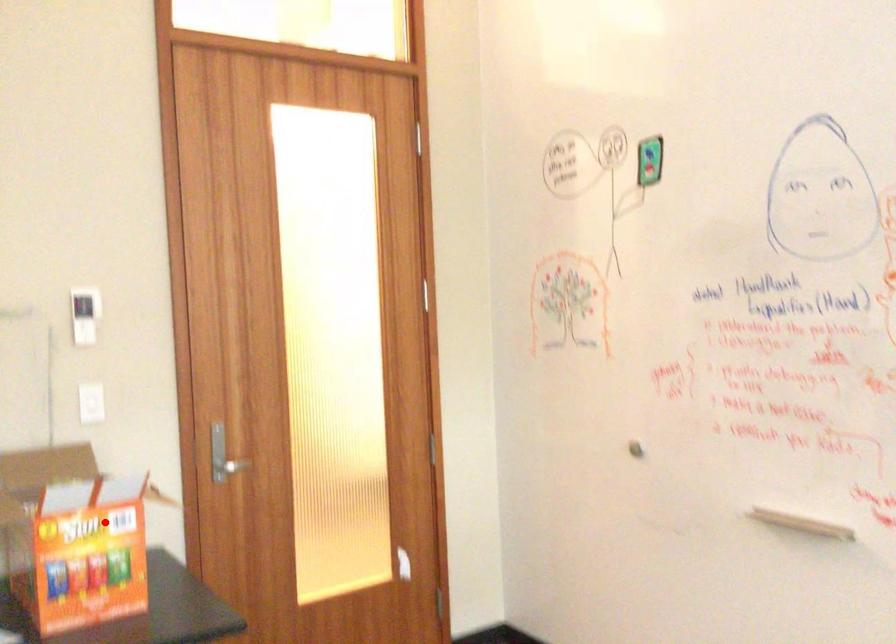
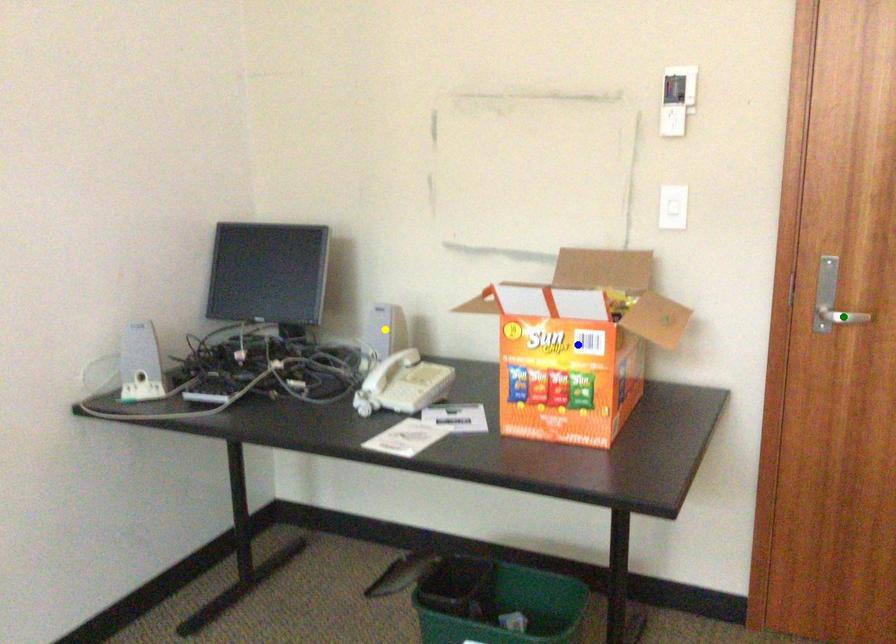
Question: I am providing you with two images of the same scene from different viewpoints. A red point is marked on the first image. You are given multiple points on the second image. Which mark in image 2 goes with the point in image 1?

Choices:
 (A) green point
 (B) blue point
 (C) yellow point

Answer: (B)